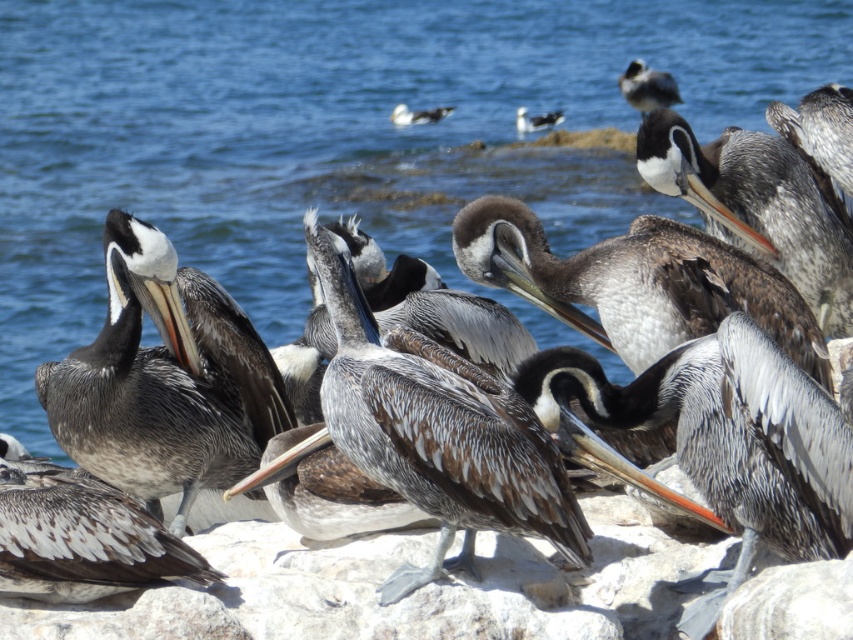
Question: Is blue water at center below brown speckled feathers at center?

Choices:
 (A) yes
 (B) no

Answer: (B)

Question: Among these points, which one is farthest from the camera?

Choices:
 (A) (590, 170)
 (B) (654, 93)

Answer: (B)

Question: Which of the following is the closest to the observer?

Choices:
 (A) (526, 120)
 (B) (370, 49)

Answer: (A)

Question: Is brown feathered pelican at center to the left of white glossy seagull at center from the viewer's perspective?

Choices:
 (A) yes
 (B) no

Answer: (A)

Question: Estimate the real-world distances between objects in this image. Which object is farther from the white glossy seagull at upper center?

Choices:
 (A) brown speckled pelican at upper right
 (B) blue water at center
 (C) brown speckled feathers at center
 (D) white glossy seagull at center

Answer: (C)

Question: Does brown speckled feathers at center come behind white glossy seagull at center?

Choices:
 (A) yes
 (B) no

Answer: (B)